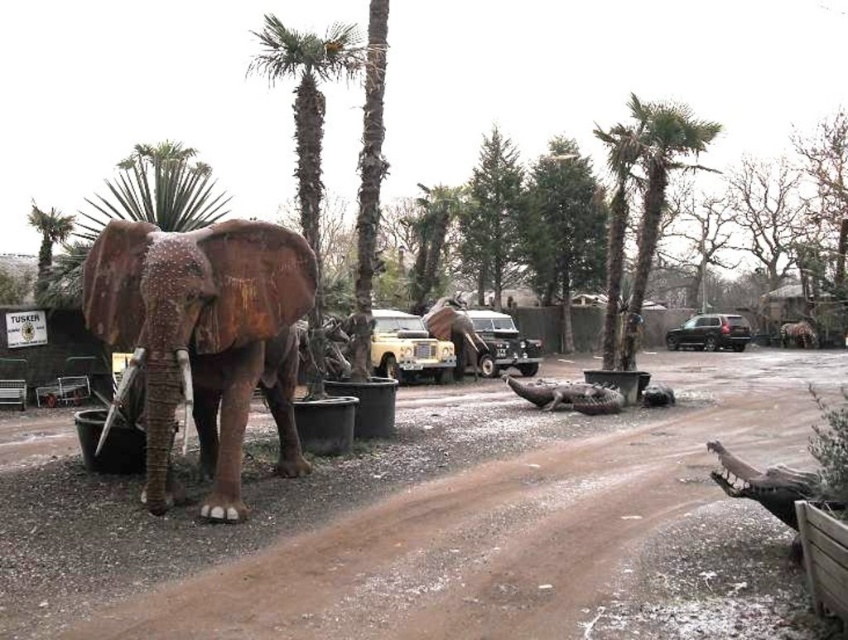
Is brown dirt track at center positioned behind green leafy palm tree at upper center?

That is False.

Can you confirm if brown dirt track at center is positioned to the right of green leafy palm tree at upper center?

No, brown dirt track at center is not to the right of green leafy palm tree at upper center.

Does point (687, 429) lie behind point (654, 152)?

No, it is not.

The width and height of the screenshot is (848, 640). I want to click on brown dirt track at center, so click(441, 525).

Does brown dirt track at center lie behind green leafy palm tree at center?

No, brown dirt track at center is in front of green leafy palm tree at center.

From the picture: Is brown dirt track at center to the right of green leafy palm tree at center from the viewer's perspective?

Yes, brown dirt track at center is to the right of green leafy palm tree at center.

Between point (399, 532) and point (318, 259), which one is positioned behind?

Point (318, 259)

Locate an element on the screen. The image size is (848, 640). brown dirt track at center is located at coordinates (441, 525).

Who is taller, green leafy palm tree at upper center or green leafy palm tree at center?

green leafy palm tree at center is taller.

Consider the image. Can you confirm if green leafy palm tree at upper center is positioned to the right of green leafy palm tree at center?

Correct, you'll find green leafy palm tree at upper center to the right of green leafy palm tree at center.

In order to click on green leafy palm tree at upper center in this screenshot , I will do `click(642, 204)`.